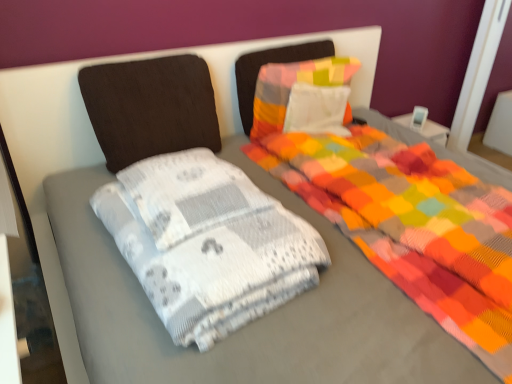
Question: Are dark brown fabric pillow at upper left, placed as the 1th pillow when sorted from left to right, and white textured blanket at center beside each other?

Choices:
 (A) yes
 (B) no

Answer: (B)

Question: Is dark brown fabric pillow at upper left, placed as the 1th pillow when sorted from left to right, bigger than white textured blanket at center?

Choices:
 (A) no
 (B) yes

Answer: (A)

Question: Is dark brown fabric pillow at upper left, which is the second pillow from right to left, not inside white textured blanket at center?

Choices:
 (A) yes
 (B) no

Answer: (A)

Question: Is dark brown fabric pillow at upper left, which is the second pillow from right to left, aimed at white textured blanket at center?

Choices:
 (A) yes
 (B) no

Answer: (A)

Question: Looking at the image, does multicolored fabric pillow at center, the 2th pillow from the left, seem bigger or smaller compared to white textured blanket at center?

Choices:
 (A) small
 (B) big

Answer: (A)

Question: Choose the correct answer: Is multicolored fabric pillow at center, the 2th pillow from the left, inside white textured blanket at center or outside it?

Choices:
 (A) inside
 (B) outside

Answer: (B)

Question: Considering the positions of point click(x=330, y=71) and point click(x=126, y=253), is point click(x=330, y=71) closer or farther from the camera than point click(x=126, y=253)?

Choices:
 (A) closer
 (B) farther

Answer: (B)

Question: In the image, is multicolored fabric pillow at center, the 2th pillow from the left, positioned in front of or behind white textured blanket at center?

Choices:
 (A) behind
 (B) front

Answer: (A)

Question: In terms of size, does dark brown fabric pillow at upper left, which is the second pillow from right to left, appear bigger or smaller than multicolored fabric pillow at center, the 2th pillow from the left?

Choices:
 (A) big
 (B) small

Answer: (A)

Question: Considering their positions, is dark brown fabric pillow at upper left, placed as the 1th pillow when sorted from left to right, located in front of or behind multicolored fabric pillow at center, the 2th pillow from the left?

Choices:
 (A) behind
 (B) front

Answer: (B)

Question: Is dark brown fabric pillow at upper left, which is the second pillow from right to left, wider or thinner than multicolored fabric pillow at center, the 1th pillow in the right-to-left sequence?

Choices:
 (A) wide
 (B) thin

Answer: (B)

Question: Is point (123, 100) positioned closer to the camera than point (339, 62)?

Choices:
 (A) farther
 (B) closer

Answer: (B)

Question: From their relative heights in the image, would you say dark brown fabric pillow at upper left, placed as the 1th pillow when sorted from left to right, is taller or shorter than white textured blanket at center?

Choices:
 (A) tall
 (B) short

Answer: (A)

Question: From a real-world perspective, is dark brown fabric pillow at upper left, placed as the 1th pillow when sorted from left to right, above or below white textured blanket at center?

Choices:
 (A) above
 (B) below

Answer: (A)